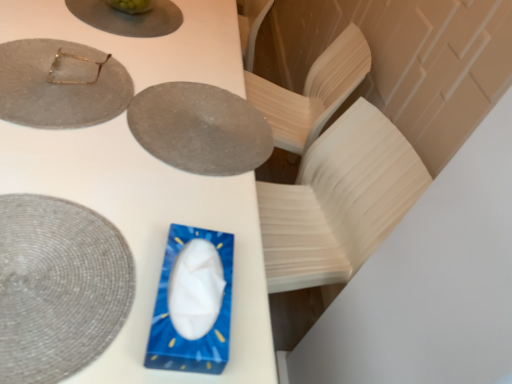
At what (x,y) coordinates should I click in order to perform the action: click on vacant area situated below matte gray placemat at upper left, acting as the 2th plate starting from the top (from a real-world perspective). Please return your answer as a coordinate pair (x, y). The image size is (512, 384). Looking at the image, I should click on (50, 77).